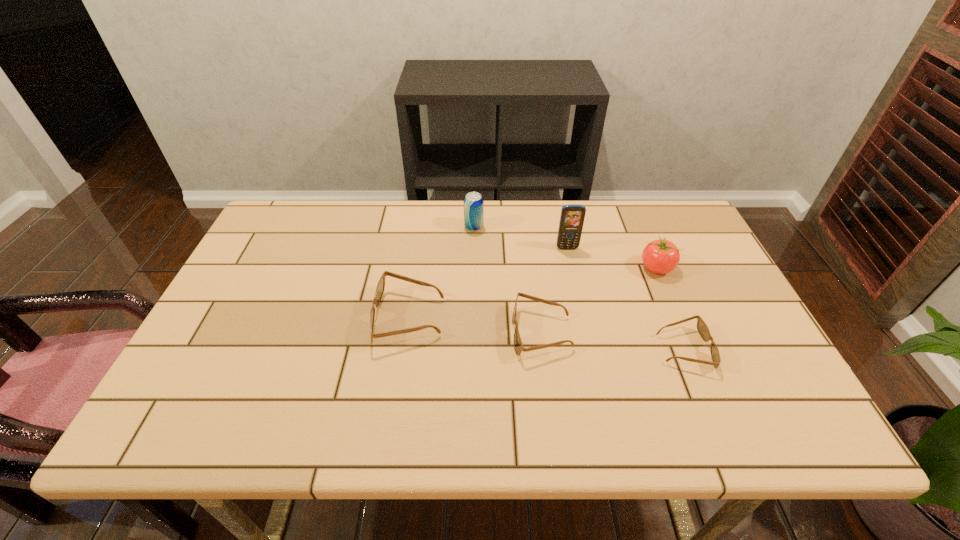
Locate an element on the screen. This screenshot has width=960, height=540. tomato is located at coordinates (660, 256).

At what (x,y) coordinates should I click in order to perform the action: click on the third farthest object. Please return your answer as a coordinate pair (x, y). Looking at the image, I should click on (660, 256).

Locate an element on the screen. vacant area situated 0.400m on the frames of the leftmost object is located at coordinates (216, 318).

Identify the location of vacant space located on the frames of the leftmost object. The width and height of the screenshot is (960, 540). pos(296,318).

Where is `free spot located 0.360m on the frames of the leftmost object`? This screenshot has width=960, height=540. free spot located 0.360m on the frames of the leftmost object is located at coordinates (232, 318).

I want to click on vacant space situated 0.360m on the frames of the third object from left to right, so click(x=366, y=333).

The width and height of the screenshot is (960, 540). In order to click on free location located 0.240m on the frames of the third object from left to right in this screenshot , I will do `click(415, 333)`.

Identify the location of vacant position located 0.050m on the frames of the third object from left to right. The image size is (960, 540). (492, 333).

Where is `blank area located on the frames of the shortest sunglasses`? Image resolution: width=960 pixels, height=540 pixels. blank area located on the frames of the shortest sunglasses is located at coordinates 742,349.

I want to click on vacant region located 0.370m on the front of the beer can, so pyautogui.click(x=472, y=326).